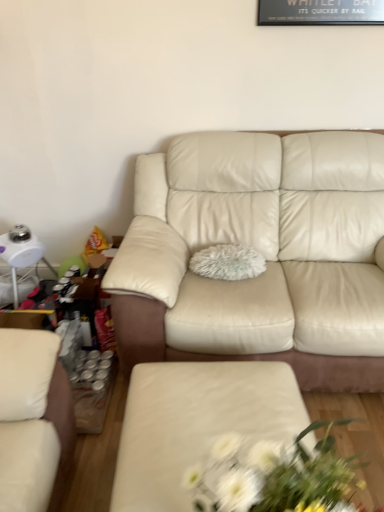
The width and height of the screenshot is (384, 512). Find the location of `blank space above matte cream ottoman at center (from a real-world perspective)`. blank space above matte cream ottoman at center (from a real-world perspective) is located at coordinates (215, 405).